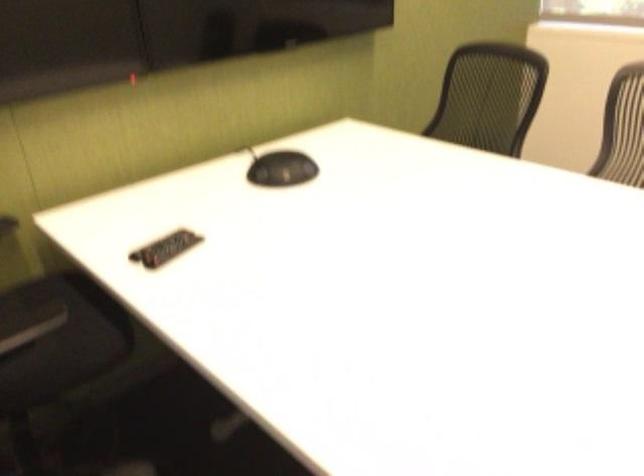
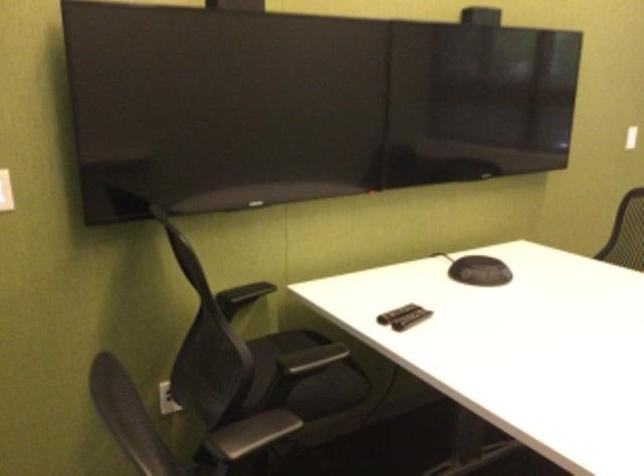
Find the pixel in the second image that matches point 166,251 in the first image.

(411, 319)